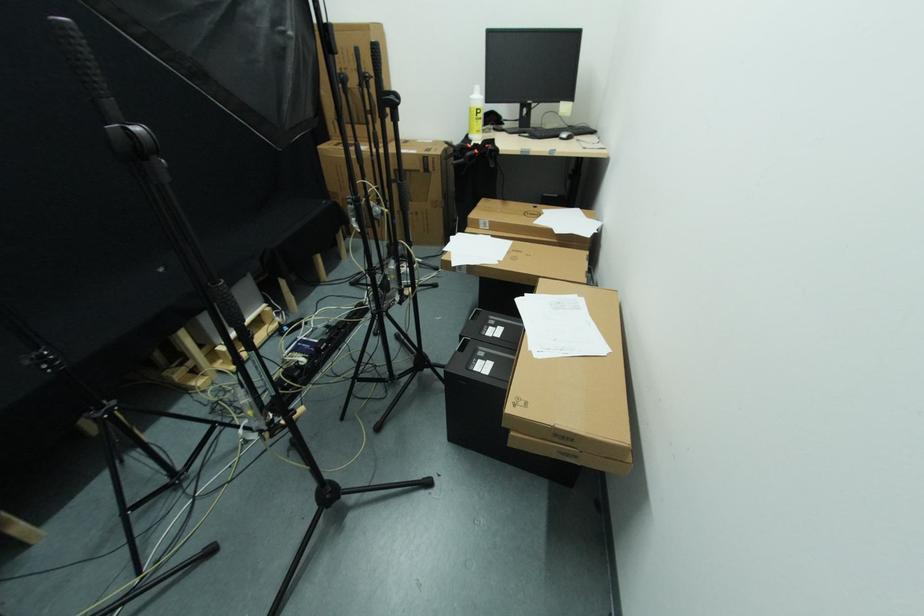
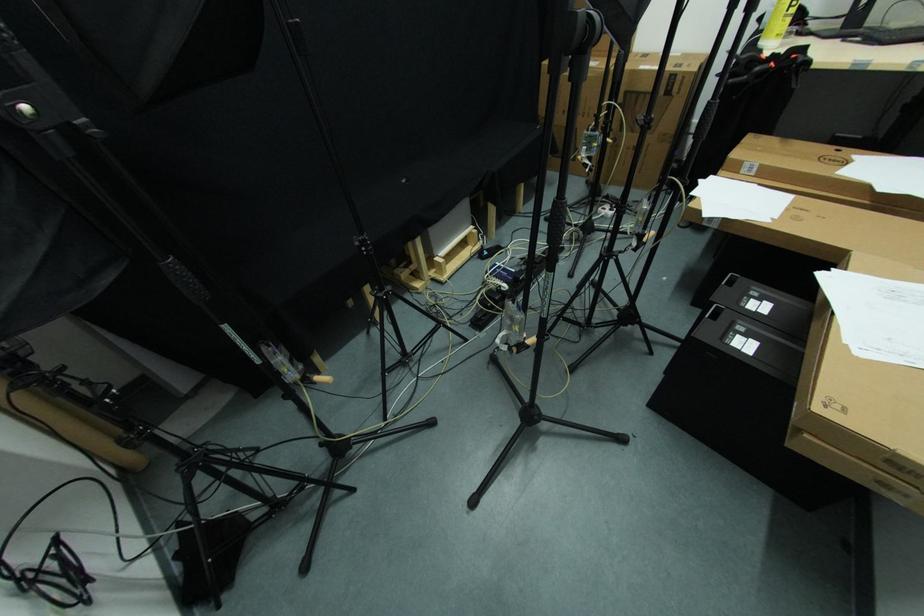
Question: Based on the continuous images, in which direction is the camera rotating? Reply with the corresponding letter.

Choices:
 (A) Left
 (B) Right
 (C) Up
 (D) Down

Answer: (A)